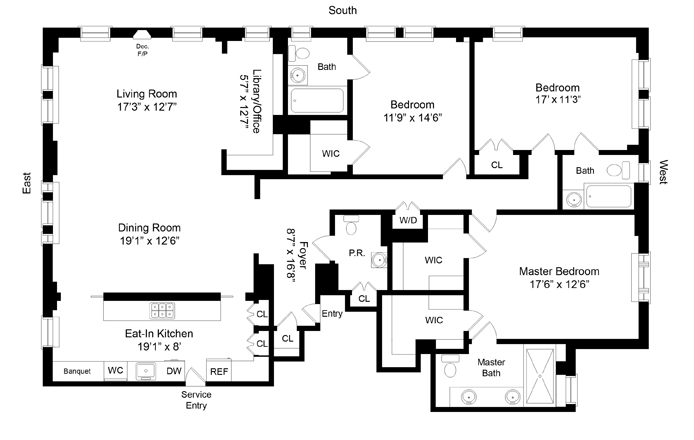
Find the location of a particular element. The height and width of the screenshot is (440, 694). master bathwc is located at coordinates (513, 383), (439, 319).